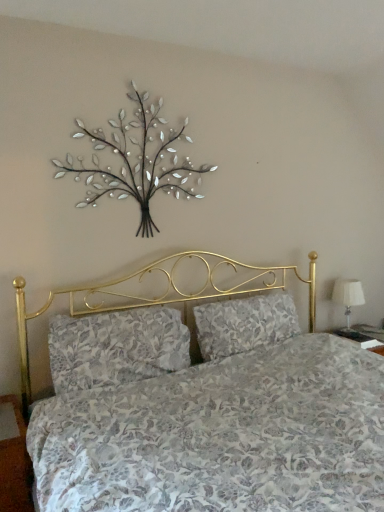
Find the location of a particular element. The image size is (384, 512). metallic silver tree at upper center is located at coordinates (136, 162).

Locate an element on the screen. The height and width of the screenshot is (512, 384). floral fabric pillow at center, which is the first pillow from right to left is located at coordinates (244, 324).

Where is `white fabric lampshade at right`? white fabric lampshade at right is located at coordinates (x=348, y=298).

Considering the positions of objects metallic silver tree at upper center and floral fabric pillow at center, positioned as the 2th pillow in right-to-left order, in the image provided, who is in front, metallic silver tree at upper center or floral fabric pillow at center, positioned as the 2th pillow in right-to-left order,?

floral fabric pillow at center, positioned as the 2th pillow in right-to-left order, is in front.

Does metallic silver tree at upper center have a lesser width compared to floral fabric pillow at center, which is the first pillow in left-to-right order?

Yes.

From a real-world perspective, who is located higher, metallic silver tree at upper center or floral fabric pillow at center, positioned as the 2th pillow in right-to-left order?

From a 3D spatial view, metallic silver tree at upper center is above.

From the image's perspective, is metallic silver tree at upper center over floral fabric pillow at center, positioned as the 2th pillow in right-to-left order?

Correct, metallic silver tree at upper center appears higher than floral fabric pillow at center, positioned as the 2th pillow in right-to-left order, in the image.

From the image's perspective, which is above, floral fabric pillow at center, which is the first pillow from right to left, or white fabric lampshade at right?

white fabric lampshade at right is shown above in the image.

Looking at their sizes, would you say floral fabric pillow at center, the second pillow from the left, is wider or thinner than white fabric lampshade at right?

floral fabric pillow at center, the second pillow from the left, is wider than white fabric lampshade at right.

Can you tell me how much floral fabric pillow at center, which is the first pillow from right to left, and white fabric lampshade at right differ in facing direction?

The facing directions of floral fabric pillow at center, which is the first pillow from right to left, and white fabric lampshade at right are 0.639 degrees apart.

Does floral fabric pillow at center, the second pillow from the left, have a larger size compared to white fabric lampshade at right?

Correct, floral fabric pillow at center, the second pillow from the left, is larger in size than white fabric lampshade at right.

In the image, there is a floral fabric pillow at center, which is the first pillow from right to left. In order to click on pillow below it (from the image's perspective) in this screenshot , I will do `click(116, 347)`.

Between point (140, 327) and point (212, 328), which one is positioned in front?

The point (140, 327) is closer to the camera.

Are floral fabric pillow at center, which is the first pillow in left-to-right order, and floral fabric pillow at center, which is the first pillow from right to left, located far from each other?

No, there isn't a large distance between floral fabric pillow at center, which is the first pillow in left-to-right order, and floral fabric pillow at center, which is the first pillow from right to left.

Identify the location of table lamp on the right of floral fabric pillow at center, which is the first pillow in left-to-right order. (348, 298).

Is point (356, 279) less distant than point (105, 330)?

That is False.

Is white fabric lampshade at right far away from floral fabric pillow at center, which is the first pillow in left-to-right order?

Yes, white fabric lampshade at right is far from floral fabric pillow at center, which is the first pillow in left-to-right order.

From a real-world perspective, is white fabric lampshade at right beneath floral fabric pillow at center, which is the first pillow in left-to-right order?

Yes, from a real-world perspective, white fabric lampshade at right is below floral fabric pillow at center, which is the first pillow in left-to-right order.

Is floral fabric pillow at center, positioned as the 2th pillow in right-to-left order, not near metallic silver tree at upper center?

That's not correct — floral fabric pillow at center, positioned as the 2th pillow in right-to-left order, is a little close to metallic silver tree at upper center.

Consider the image. Considering the relative positions of floral fabric pillow at center, positioned as the 2th pillow in right-to-left order, and metallic silver tree at upper center in the image provided, is floral fabric pillow at center, positioned as the 2th pillow in right-to-left order, to the right of metallic silver tree at upper center from the viewer's perspective?

No.

From the image's perspective, is floral fabric pillow at center, positioned as the 2th pillow in right-to-left order, located beneath metallic silver tree at upper center?

Correct, floral fabric pillow at center, positioned as the 2th pillow in right-to-left order, appears lower than metallic silver tree at upper center in the image.

Does floral fabric pillow at center, positioned as the 2th pillow in right-to-left order, lie in front of metallic silver tree at upper center?

Yes.

This screenshot has height=512, width=384. Find the location of `pillow behind the floral fabric pillow at center, which is the first pillow in left-to-right order`. pillow behind the floral fabric pillow at center, which is the first pillow in left-to-right order is located at coordinates (244, 324).

In the scene shown: Considering the relative positions of floral fabric pillow at center, which is the first pillow from right to left, and floral fabric pillow at center, which is the first pillow in left-to-right order, in the image provided, is floral fabric pillow at center, which is the first pillow from right to left, to the left of floral fabric pillow at center, which is the first pillow in left-to-right order, from the viewer's perspective?

Incorrect, floral fabric pillow at center, which is the first pillow from right to left, is not on the left side of floral fabric pillow at center, which is the first pillow in left-to-right order.

From the image's perspective, is floral fabric pillow at center, which is the first pillow from right to left, located above or below floral fabric pillow at center, positioned as the 2th pillow in right-to-left order?

From the image's perspective, floral fabric pillow at center, which is the first pillow from right to left, appears above floral fabric pillow at center, positioned as the 2th pillow in right-to-left order.

Considering the sizes of objects floral fabric pillow at center, the second pillow from the left, and floral fabric pillow at center, positioned as the 2th pillow in right-to-left order, in the image provided, who is smaller, floral fabric pillow at center, the second pillow from the left, or floral fabric pillow at center, positioned as the 2th pillow in right-to-left order,?

floral fabric pillow at center, the second pillow from the left.

From a real-world perspective, which is physically above, metallic silver tree at upper center or white fabric lampshade at right?

metallic silver tree at upper center is physically above.

Is metallic silver tree at upper center facing towards white fabric lampshade at right?

No, metallic silver tree at upper center is not oriented towards white fabric lampshade at right.

From the image's perspective, would you say metallic silver tree at upper center is positioned over white fabric lampshade at right?

Yes.

I want to click on floral arrangement behind the floral fabric pillow at center, which is the first pillow in left-to-right order, so click(136, 162).

In order to click on the 1st pillow below the white fabric lampshade at right (from the image's perspective) in this screenshot , I will do `click(244, 324)`.

Looking at the image, which one is located further to metallic silver tree at upper center, floral fabric pillow at center, the second pillow from the left, or floral fabric pillow at center, positioned as the 2th pillow in right-to-left order?

The object further to metallic silver tree at upper center is floral fabric pillow at center, the second pillow from the left.

From the picture: Which object lies further to the anchor point floral fabric pillow at center, which is the first pillow in left-to-right order, metallic silver tree at upper center or floral fabric pillow at center, which is the first pillow from right to left?

metallic silver tree at upper center.

Estimate the real-world distances between objects in this image. Which object is closer to white fabric lampshade at right, floral fabric pillow at center, positioned as the 2th pillow in right-to-left order, or metallic silver tree at upper center?

metallic silver tree at upper center.

Estimate the real-world distances between objects in this image. Which object is further from metallic silver tree at upper center, white fabric lampshade at right or floral fabric pillow at center, positioned as the 2th pillow in right-to-left order?

white fabric lampshade at right is further to metallic silver tree at upper center.

From the image, which object appears to be nearer to metallic silver tree at upper center, floral fabric pillow at center, which is the first pillow in left-to-right order, or white fabric lampshade at right?

floral fabric pillow at center, which is the first pillow in left-to-right order, is positioned closer to the anchor metallic silver tree at upper center.

Estimate the real-world distances between objects in this image. Which object is further from white fabric lampshade at right, metallic silver tree at upper center or floral fabric pillow at center, which is the first pillow in left-to-right order?

The object further to white fabric lampshade at right is floral fabric pillow at center, which is the first pillow in left-to-right order.

Which object lies nearer to the anchor point floral fabric pillow at center, the second pillow from the left, floral fabric pillow at center, which is the first pillow in left-to-right order, or white fabric lampshade at right?

The object closer to floral fabric pillow at center, the second pillow from the left, is floral fabric pillow at center, which is the first pillow in left-to-right order.

From the image, which object appears to be nearer to floral fabric pillow at center, positioned as the 2th pillow in right-to-left order, metallic silver tree at upper center or white fabric lampshade at right?

metallic silver tree at upper center.

This screenshot has width=384, height=512. I want to click on pillow between metallic silver tree at upper center and floral fabric pillow at center, which is the first pillow in left-to-right order, in the up-down direction, so click(x=244, y=324).

Where is `floral arrangement between floral fabric pillow at center, positioned as the 2th pillow in right-to-left order, and white fabric lampshade at right`? This screenshot has height=512, width=384. floral arrangement between floral fabric pillow at center, positioned as the 2th pillow in right-to-left order, and white fabric lampshade at right is located at coordinates (136, 162).

The height and width of the screenshot is (512, 384). I want to click on pillow between floral fabric pillow at center, positioned as the 2th pillow in right-to-left order, and white fabric lampshade at right, so click(244, 324).

You are a GUI agent. You are given a task and a screenshot of the screen. Output one action in this format:
    pyautogui.click(x=<x>, y=<y>)
    Task: Click on the pillow between metallic silver tree at upper center and white fabric lampshade at right from left to right
    The height and width of the screenshot is (512, 384).
    Given the screenshot: What is the action you would take?
    pyautogui.click(x=244, y=324)